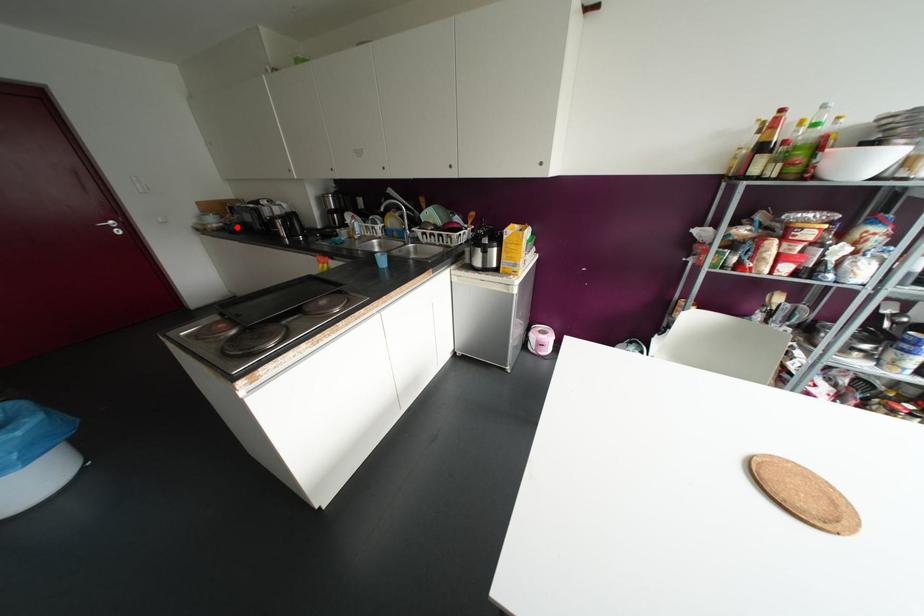
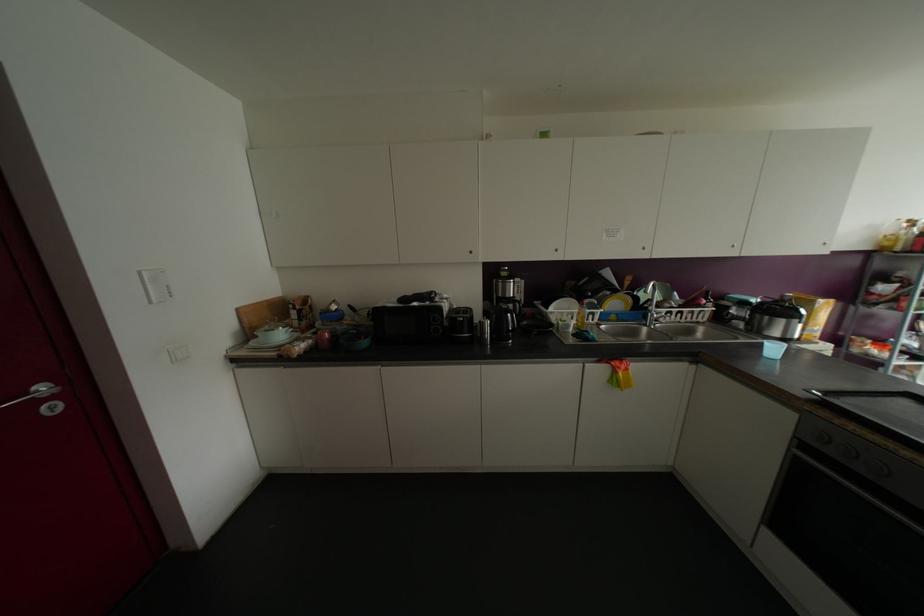
Where in the second image is the point corresponding to the highlighted location from the first image?

(363, 342)